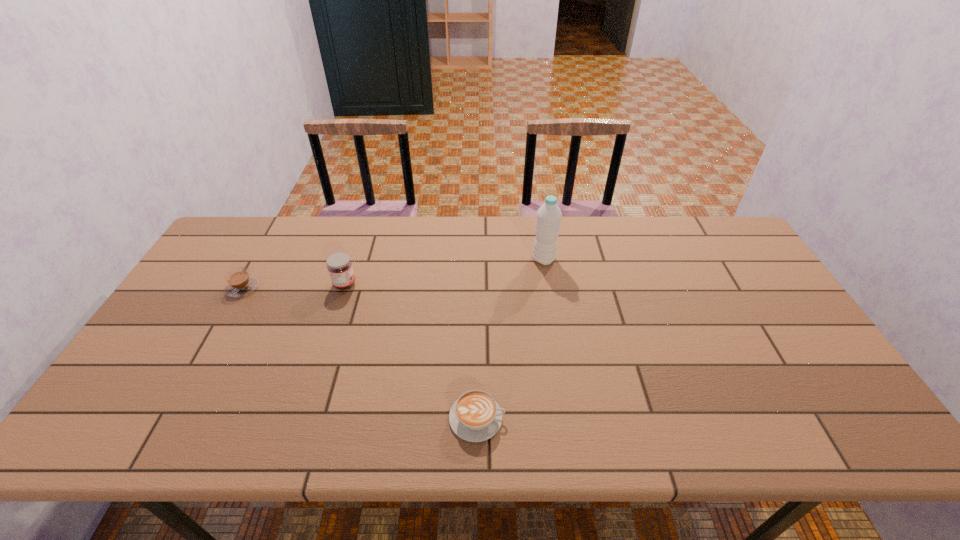
In order to click on the third closest object to the farther cappuccino in this screenshot , I will do `click(548, 220)`.

Identify which object is the third closest to the shortest object. Please provide its 2D coordinates. Your answer should be formatted as a tuple, i.e. [(x, y)], where the tuple contains the x and y coordinates of a point satisfying the conditions above.

[(239, 283)]

Locate an element on the screen. This screenshot has width=960, height=540. vacant area in the image that satisfies the following two spatial constraints: 1. on the back side of the second object from left to right; 2. on the right side of the farther cappuccino is located at coordinates (245, 284).

I want to click on vacant space that satisfies the following two spatial constraints: 1. on the back side of the second object from left to right; 2. on the left side of the leftmost object, so 245,284.

Identify the location of free space that satisfies the following two spatial constraints: 1. on the back side of the farthest object; 2. on the right side of the third shortest object. The width and height of the screenshot is (960, 540). (352, 259).

What are the coordinates of `free location that satisfies the following two spatial constraints: 1. on the front side of the rightmost object; 2. on the side of the right cappuccino with the handle` in the screenshot? It's located at (569, 418).